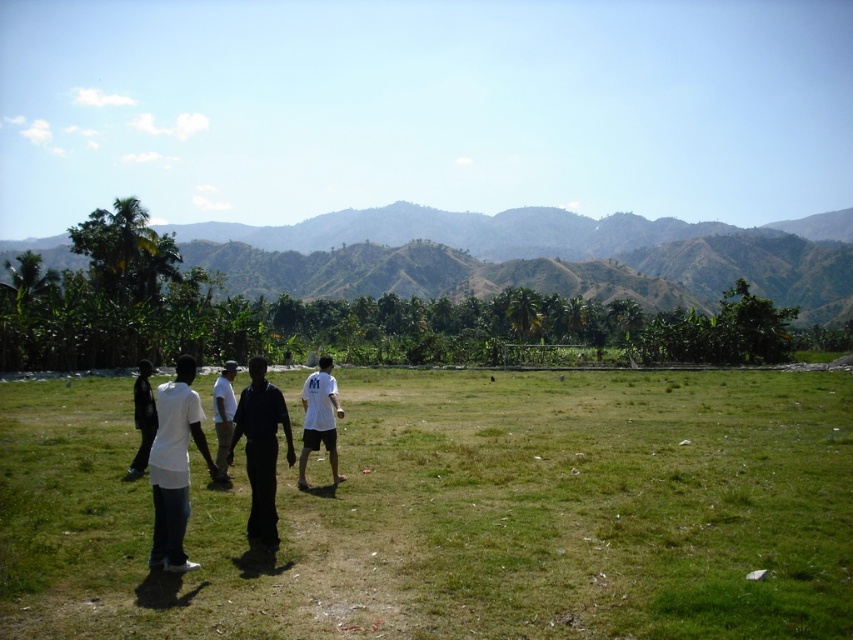
Question: Is black matte pants at center bigger than white matte shirt at center?

Choices:
 (A) no
 (B) yes

Answer: (B)

Question: Which object appears farthest from the camera in this image?

Choices:
 (A) green leafy mountain at center
 (B) white cotton shirt at center
 (C) white matte shirt at lower left
 (D) green grass at lower left

Answer: (A)

Question: Among these objects, which one is nearest to the camera?

Choices:
 (A) green grass at lower left
 (B) green leafy mountain at center

Answer: (A)

Question: Does green grass at lower left have a smaller size compared to white cotton shirt at center?

Choices:
 (A) no
 (B) yes

Answer: (B)

Question: Which point is closer to the camera?

Choices:
 (A) white matte shirt at center
 (B) green grass at lower left

Answer: (B)

Question: Observing the image, what is the correct spatial positioning of green grass at lower left in reference to green leafy mountain at center?

Choices:
 (A) above
 (B) below

Answer: (B)